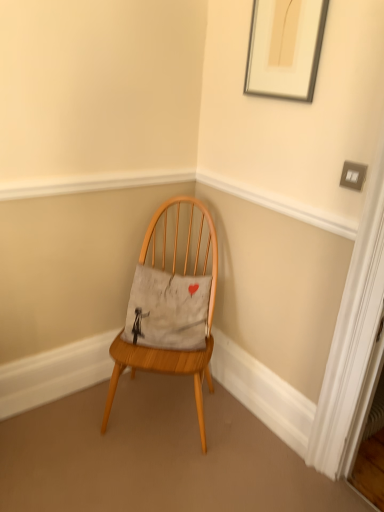
Question: Considering the relative sizes of gray cotton pillow at center and wooden chair at center in the image provided, is gray cotton pillow at center taller than wooden chair at center?

Choices:
 (A) no
 (B) yes

Answer: (A)

Question: Is gray cotton pillow at center at the right side of wooden chair at center?

Choices:
 (A) yes
 (B) no

Answer: (B)

Question: Considering the relative sizes of gray cotton pillow at center and wooden chair at center in the image provided, is gray cotton pillow at center smaller than wooden chair at center?

Choices:
 (A) yes
 (B) no

Answer: (A)

Question: Is gray cotton pillow at center further to the viewer compared to wooden chair at center?

Choices:
 (A) no
 (B) yes

Answer: (B)

Question: From a real-world perspective, is gray cotton pillow at center positioned over wooden chair at center based on gravity?

Choices:
 (A) no
 (B) yes

Answer: (B)

Question: From the image's perspective, is wooden chair at center positioned above or below silver metallic picture frame at upper right?

Choices:
 (A) below
 (B) above

Answer: (A)

Question: Considering the relative positions of wooden chair at center and silver metallic picture frame at upper right in the image provided, is wooden chair at center to the left or to the right of silver metallic picture frame at upper right?

Choices:
 (A) right
 (B) left

Answer: (B)

Question: Is wooden chair at center taller or shorter than silver metallic picture frame at upper right?

Choices:
 (A) tall
 (B) short

Answer: (A)

Question: From a real-world perspective, is wooden chair at center physically located above or below silver metallic picture frame at upper right?

Choices:
 (A) below
 (B) above

Answer: (A)

Question: From a real-world perspective, is wooden chair at center physically located above or below gray cotton pillow at center?

Choices:
 (A) below
 (B) above

Answer: (A)

Question: Considering the positions of wooden chair at center and gray cotton pillow at center in the image, is wooden chair at center wider or thinner than gray cotton pillow at center?

Choices:
 (A) thin
 (B) wide

Answer: (B)

Question: From the image's perspective, is wooden chair at center above or below gray cotton pillow at center?

Choices:
 (A) below
 (B) above

Answer: (A)

Question: Considering the positions of wooden chair at center and gray cotton pillow at center in the image, is wooden chair at center taller or shorter than gray cotton pillow at center?

Choices:
 (A) tall
 (B) short

Answer: (A)

Question: Relative to wooden chair at center, is silver metallic picture frame at upper right in front or behind?

Choices:
 (A) front
 (B) behind

Answer: (A)

Question: From the image's perspective, is silver metallic picture frame at upper right above or below wooden chair at center?

Choices:
 (A) below
 (B) above

Answer: (B)